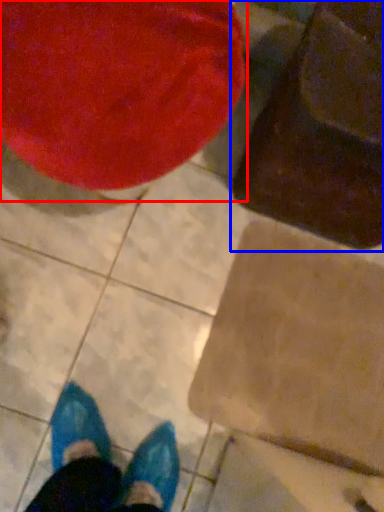
Question: Which of the following is the farthest to the observer, bean bag chair (highlighted by a red box) or bean bag chair (highlighted by a blue box)?

Choices:
 (A) bean bag chair
 (B) bean bag chair

Answer: (B)